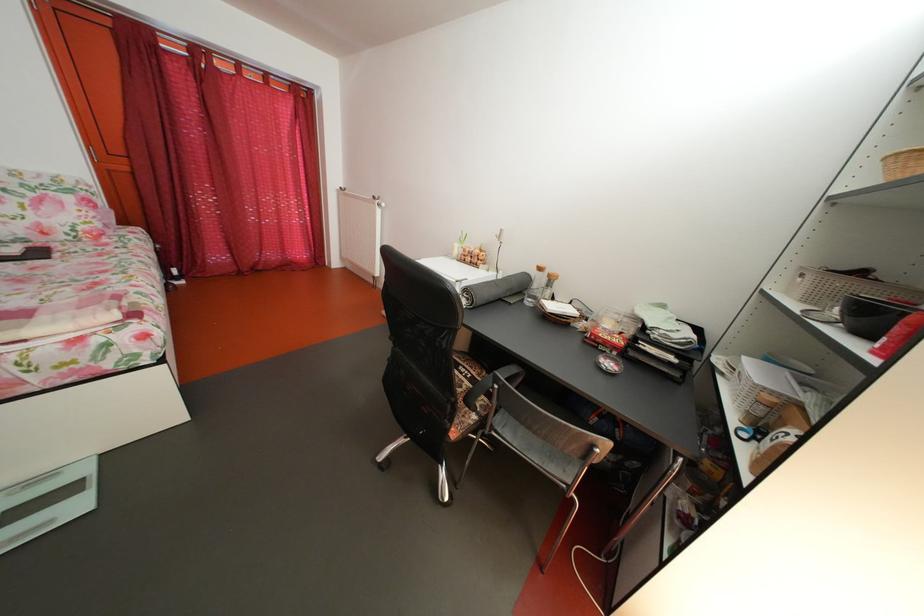
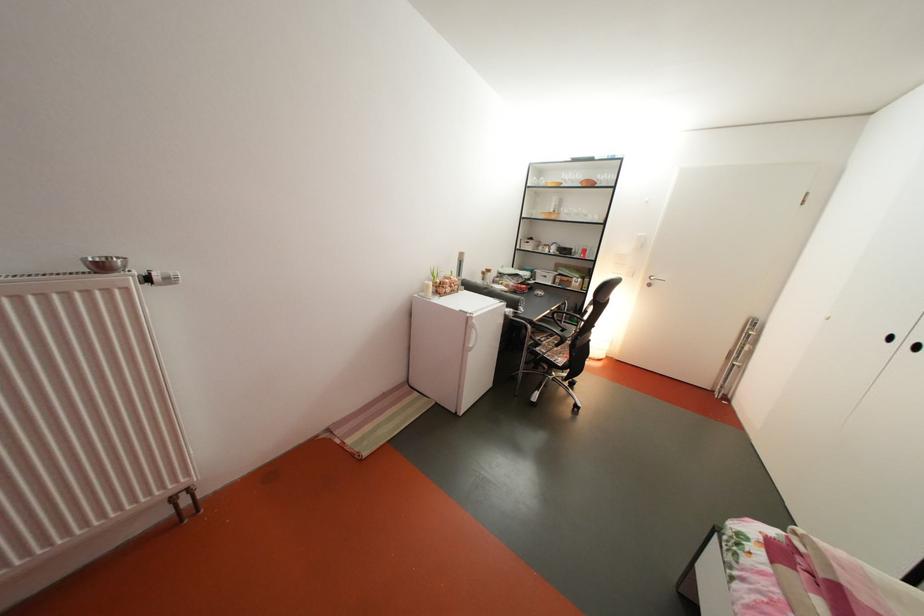
The point at (466, 253) is marked in the first image. Where is the corresponding point in the second image?

(439, 293)